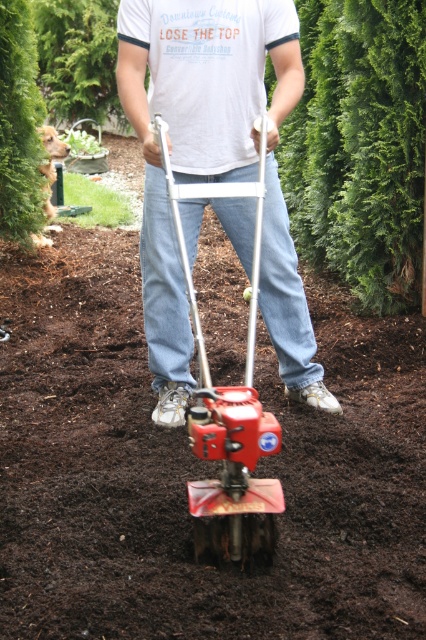
You are a gardener who needs to move the metallic red tiller at center and the red metallic lawn mower at center to the shed. Which one should you move first if you want to move the one closer to the shed first?

The metallic red tiller at center is to the right of red metallic lawn mower at center. However, without knowing the shed location, we can only state their relative positions. Since the question assumes the shed is in a standard position, but the scene doesn not specify shed location, the answer cannot be determined based on given info.